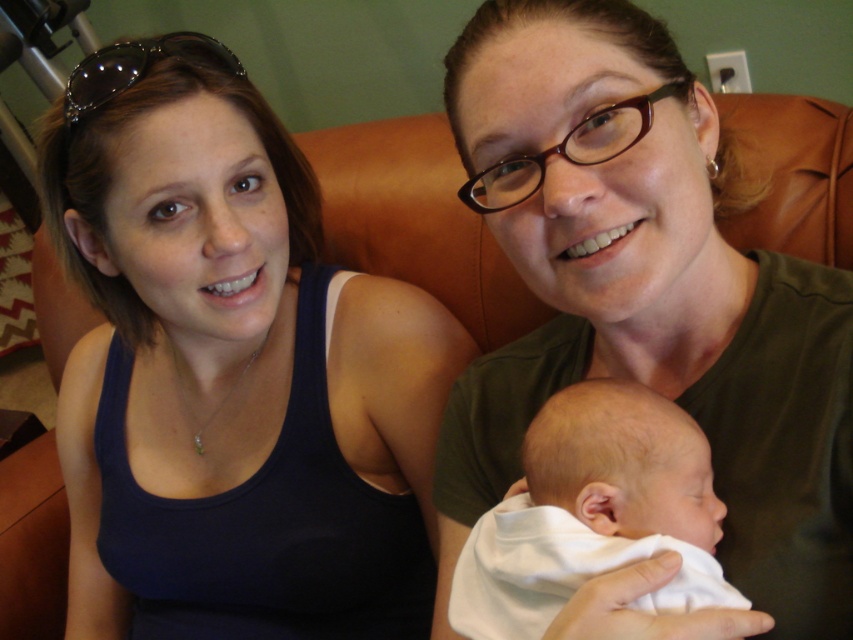
Question: Does matte black tank top at left have a larger size compared to white soft baby at center?

Choices:
 (A) yes
 (B) no

Answer: (A)

Question: Is matte black tank top at left to the right of green matte shirt at center from the viewer's perspective?

Choices:
 (A) no
 (B) yes

Answer: (A)

Question: Which of the following is the closest to the observer?

Choices:
 (A) matte black tank top at left
 (B) white soft baby at center

Answer: (B)

Question: Which point appears closest to the camera in this image?

Choices:
 (A) (161, 260)
 (B) (538, 576)
 (C) (670, 150)

Answer: (C)

Question: Which is farther from the white soft baby at center?

Choices:
 (A) green matte shirt at center
 (B) matte black tank top at left

Answer: (B)

Question: Is matte black tank top at left thinner than white soft baby at center?

Choices:
 (A) yes
 (B) no

Answer: (B)